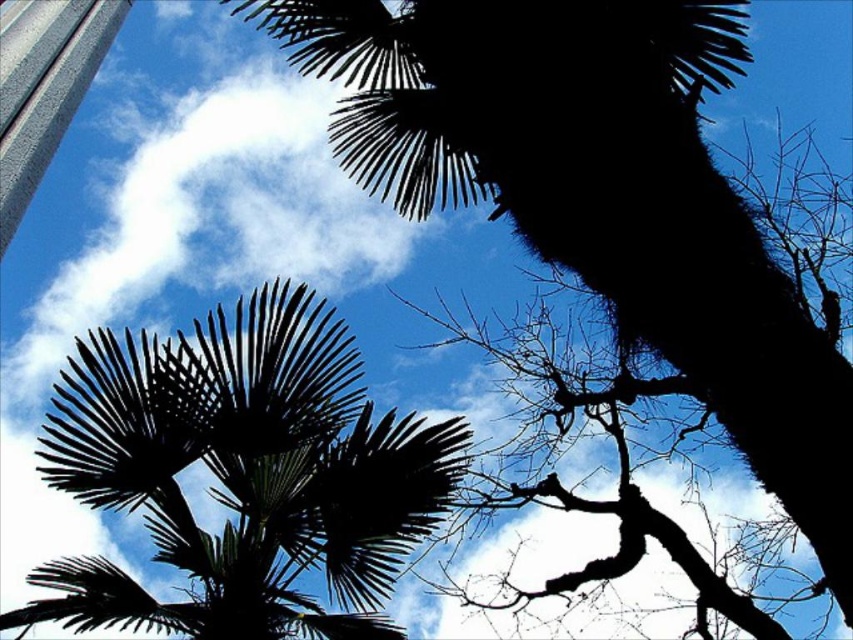
Does silhouette leafy branch at upper center have a lesser height compared to dark green leafy palm tree at center?

In fact, silhouette leafy branch at upper center may be taller than dark green leafy palm tree at center.

Which is in front, point (561, 195) or point (44, 573)?

Point (561, 195)

Identify the location of silhouette leafy branch at upper center. This screenshot has width=853, height=640. (602, 196).